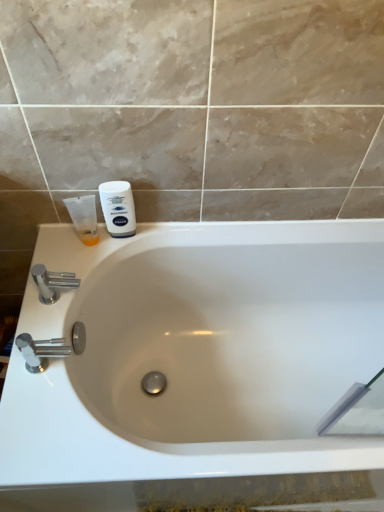
Image resolution: width=384 pixels, height=512 pixels. Identify the location of free point behind polished chrome faucet at lower left, which appears as the first tap when viewed from the front. (56, 295).